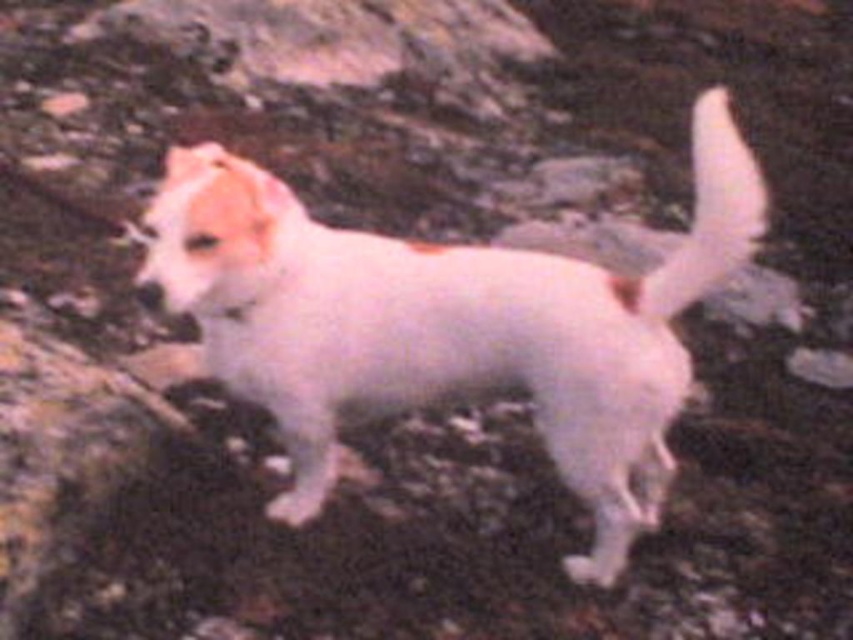
Is point (560, 353) positioned in front of point (752, 228)?

No, it is not.

Locate an element on the screen. This screenshot has width=853, height=640. white fluffy dog at center is located at coordinates (440, 324).